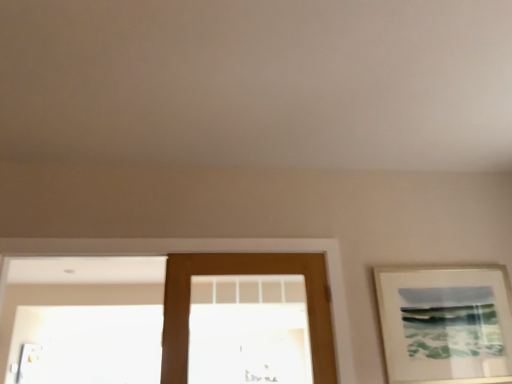
Question: Is brown wooden door at center further to camera compared to brown wooden door at center?

Choices:
 (A) yes
 (B) no

Answer: (A)

Question: From the image's perspective, does brown wooden door at center appear higher than brown wooden door at center?

Choices:
 (A) no
 (B) yes

Answer: (A)

Question: From a real-world perspective, does brown wooden door at center sit lower than brown wooden door at center?

Choices:
 (A) no
 (B) yes

Answer: (B)

Question: From a real-world perspective, is brown wooden door at center on top of brown wooden door at center?

Choices:
 (A) yes
 (B) no

Answer: (B)

Question: From the image's perspective, is brown wooden door at center below brown wooden door at center?

Choices:
 (A) no
 (B) yes

Answer: (B)

Question: From the image's perspective, is matte white picture frame at right located above or below brown wooden door at center?

Choices:
 (A) below
 (B) above

Answer: (A)

Question: Is matte white picture frame at right wider or thinner than brown wooden door at center?

Choices:
 (A) wide
 (B) thin

Answer: (B)

Question: Would you say matte white picture frame at right is to the left or to the right of brown wooden door at center in the picture?

Choices:
 (A) left
 (B) right

Answer: (B)

Question: Is point (455, 355) closer or farther from the camera than point (181, 311)?

Choices:
 (A) closer
 (B) farther

Answer: (B)

Question: Which is correct: brown wooden door at center is inside matte white picture frame at right, or outside of it?

Choices:
 (A) outside
 (B) inside

Answer: (A)

Question: From a real-world perspective, is brown wooden door at center above or below matte white picture frame at right?

Choices:
 (A) above
 (B) below

Answer: (A)

Question: Looking at their shapes, would you say brown wooden door at center is wider or thinner than matte white picture frame at right?

Choices:
 (A) wide
 (B) thin

Answer: (A)

Question: Would you say brown wooden door at center is to the left or to the right of matte white picture frame at right in the picture?

Choices:
 (A) left
 (B) right

Answer: (A)

Question: In terms of width, does brown wooden door at center look wider or thinner when compared to matte white picture frame at right?

Choices:
 (A) thin
 (B) wide

Answer: (B)

Question: From their relative heights in the image, would you say brown wooden door at center is taller or shorter than matte white picture frame at right?

Choices:
 (A) tall
 (B) short

Answer: (A)